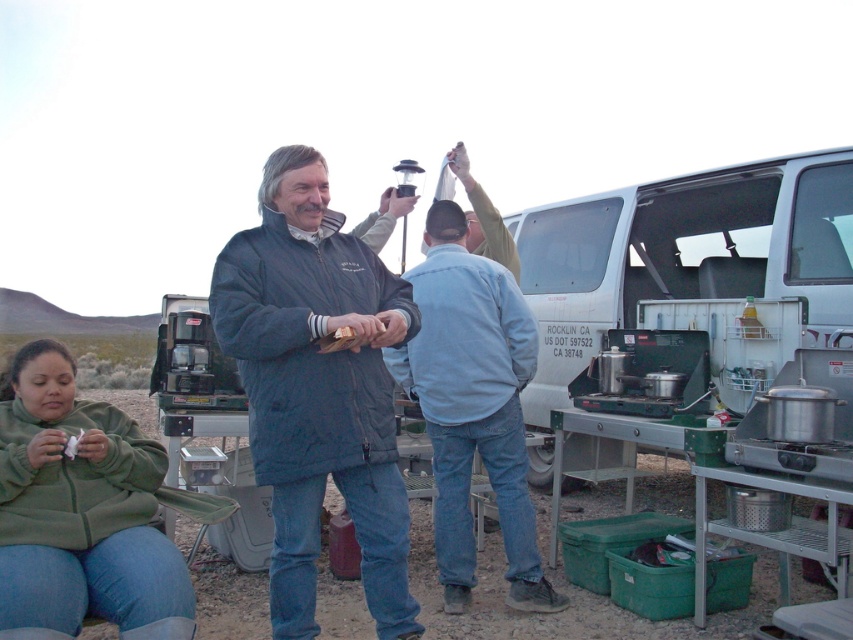
In the scene shown: You are standing at the point marked by the coordinate point (317, 388) in the image. What object is located at this point?

The point (317, 388) marks the location of the blue quilted jacket at center.

Consider the image. You are a hiker who needs to reach the white plastic van at center and the blue quilted jacket at center. Which object is positioned higher in the image?

The white plastic van at center is positioned higher than the blue quilted jacket at center in the image.

Looking at this image, you are a photographer positioned at the back of the scene. You want to take a photo of both the green fleece jacket at lower left and the light blue denim jacket at center. Which jacket will appear larger in your photo?

The green fleece jacket at lower left will appear larger in the photo because it is closer to the viewer than the light blue denim jacket at center.